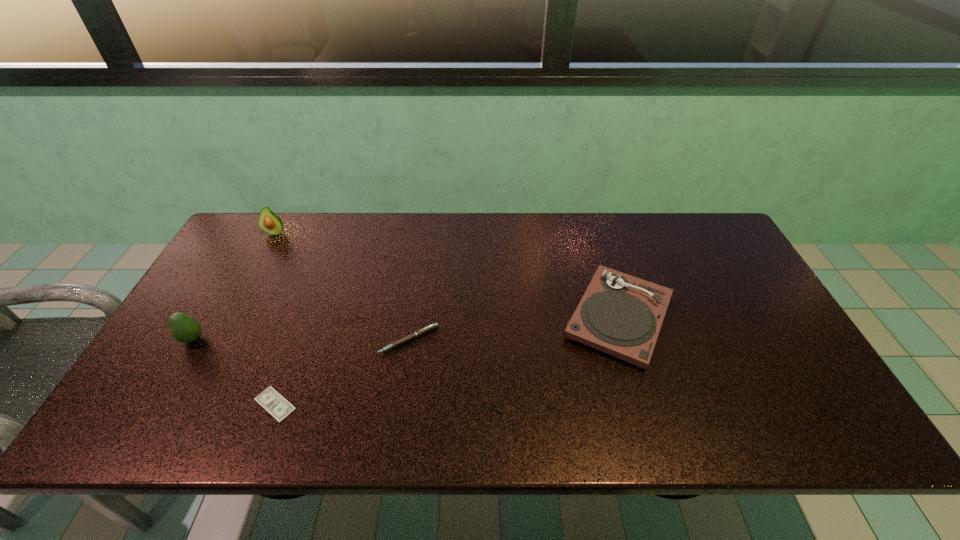
Where is `empty space that is in between the second object from right to left and the third object from left to right`? The image size is (960, 540). empty space that is in between the second object from right to left and the third object from left to right is located at coordinates 342,372.

Identify the location of object that stands as the closest to the fourth object from left to right. (269, 399).

Locate an element on the screen. The width and height of the screenshot is (960, 540). the closest object to the rightmost object is located at coordinates (424, 330).